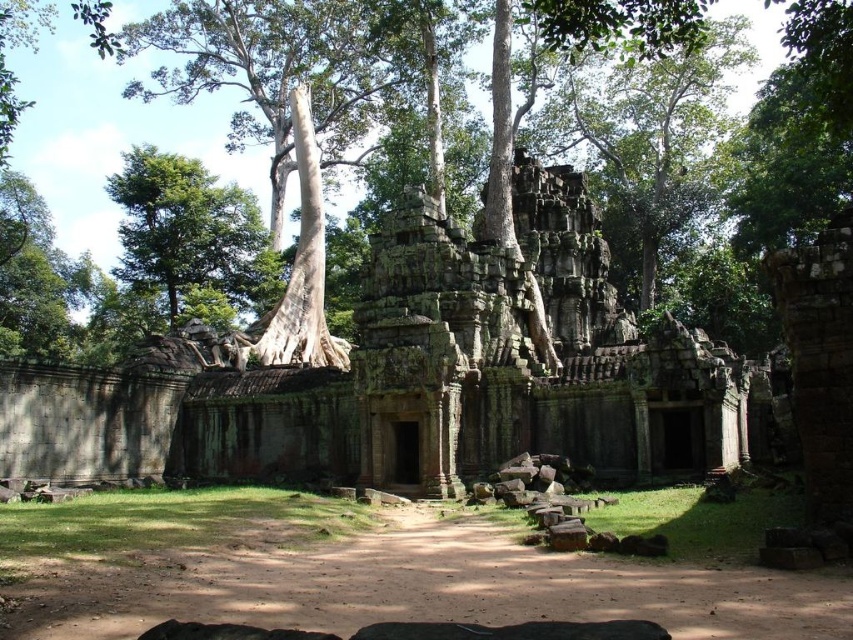
Measure the distance between point (686, 100) and camera.

177.00 meters

Is point (376, 177) behind point (257, 280)?

Yes, it is behind point (257, 280).

Who is more forward, (x=776, y=237) or (x=181, y=168)?

Point (x=776, y=237) is in front.

The width and height of the screenshot is (853, 640). Identify the location of green textured tree at center. (701, 147).